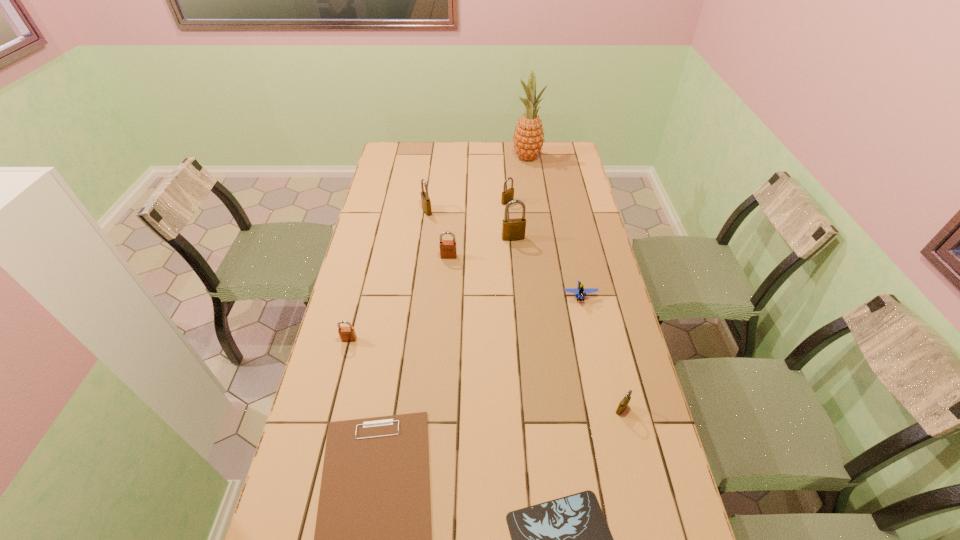
Identify the location of blank space at the far edge. (489, 147).

This screenshot has height=540, width=960. In the image, there is a desktop. Find the location of `blank space at the left edge`. blank space at the left edge is located at coordinates (409, 184).

Find the location of a particular element. The image size is (960, 540). vacant space at the right edge of the desktop is located at coordinates pyautogui.click(x=591, y=367).

You are a GUI agent. You are given a task and a screenshot of the screen. Output one action in this format:
    pyautogui.click(x=<x>, y=<y>)
    Task: Click on the free space at the far left corner of the desktop
    Image resolution: width=960 pixels, height=540 pixels.
    Given the screenshot: What is the action you would take?
    pyautogui.click(x=419, y=156)

You are a GUI agent. You are given a task and a screenshot of the screen. Output one action in this format:
    pyautogui.click(x=<x>, y=<y>)
    Task: Click on the vacant region between the farther brown padlock and the eighth tallest object
    
    Given the screenshot: What is the action you would take?
    pyautogui.click(x=515, y=276)

At what (x,y) coordinates should I click in order to perform the action: click on unoccupied position between the ninth shortest object and the third padlock from left to right. Please return your answer as a coordinate pair (x, y). Looking at the image, I should click on (481, 247).

I want to click on free space between the third shortest object and the nearest brass padlock, so click(601, 353).

Image resolution: width=960 pixels, height=540 pixels. I want to click on empty location between the farthest object and the fifth farthest object, so click(x=488, y=207).

Find the location of a particular element. The height and width of the screenshot is (540, 960). free space between the nearer brown padlock and the bigger brown padlock is located at coordinates (399, 298).

Find the location of a particular element. The height and width of the screenshot is (540, 960). the third closest object relative to the farthest object is located at coordinates (512, 229).